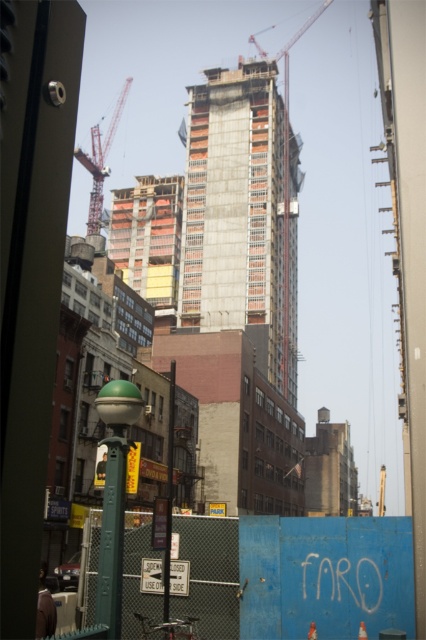
Question: Which object appears closest to the camera in this image?

Choices:
 (A) concrete construction at center
 (B) metallic construction crane at upper center
 (C) green chain-link fence at lower left

Answer: (C)

Question: Does red metal crane at upper left have a lesser width compared to metallic construction crane at upper center?

Choices:
 (A) yes
 (B) no

Answer: (A)

Question: Can you confirm if green chain-link fence at lower left is thinner than red metal crane at upper left?

Choices:
 (A) yes
 (B) no

Answer: (A)

Question: Does green chain-link fence at lower left have a larger size compared to metallic construction crane at upper center?

Choices:
 (A) no
 (B) yes

Answer: (A)

Question: Which point is closer to the camera taking this photo?

Choices:
 (A) pos(319,16)
 (B) pos(92,221)

Answer: (B)

Question: Which object is farther from the camera taking this photo?

Choices:
 (A) green chain-link fence at lower left
 (B) red metal crane at upper left
 (C) metallic construction crane at upper center

Answer: (C)